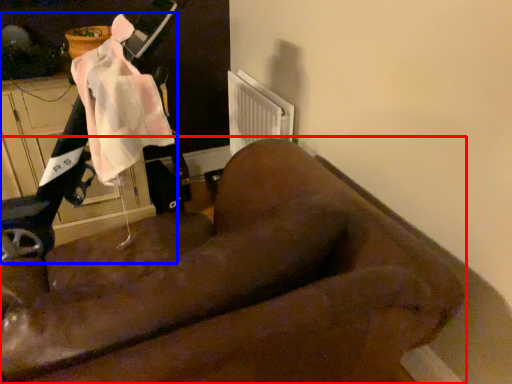
Question: Which object appears closest to the camera in this image, furniture (highlighted by a red box) or mobility scooter (highlighted by a blue box)?

Choices:
 (A) furniture
 (B) mobility scooter

Answer: (A)